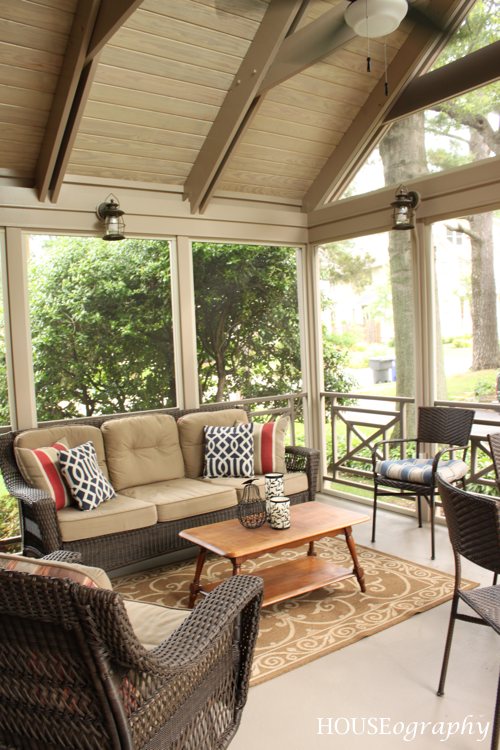
Locate an element on the screen. This screenshot has height=750, width=500. sconce is located at coordinates click(115, 207), click(400, 200).